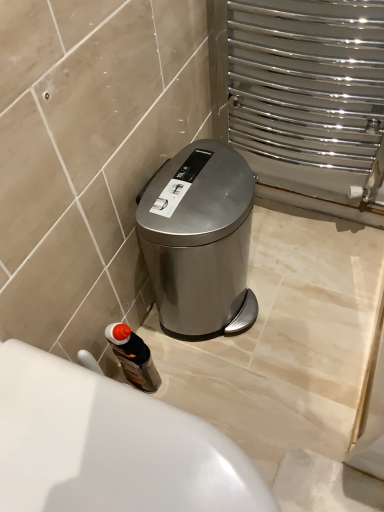
Question: Does point (218, 251) appear closer or farther from the camera than point (129, 328)?

Choices:
 (A) closer
 (B) farther

Answer: (A)

Question: Would you say satin silver trash can at center is to the left or to the right of wooden textured bottle at lower left in the picture?

Choices:
 (A) left
 (B) right

Answer: (B)

Question: Which object is positioned closest to the wooden textured bottle at lower left?

Choices:
 (A) white glossy bath at lower left
 (B) satin silver trash can at center

Answer: (B)

Question: Based on their relative distances, which object is nearer to the wooden textured bottle at lower left?

Choices:
 (A) satin silver trash can at center
 (B) white glossy bath at lower left

Answer: (A)